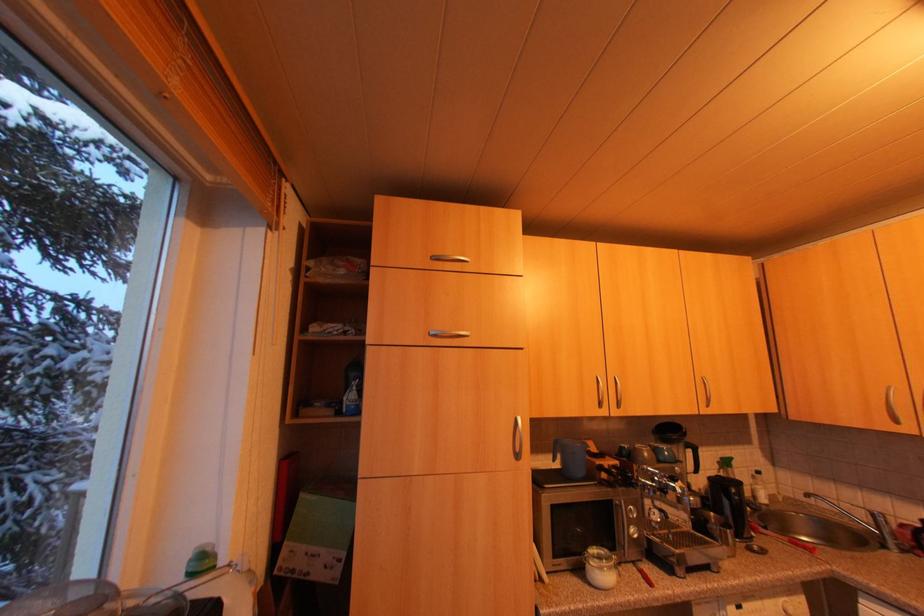
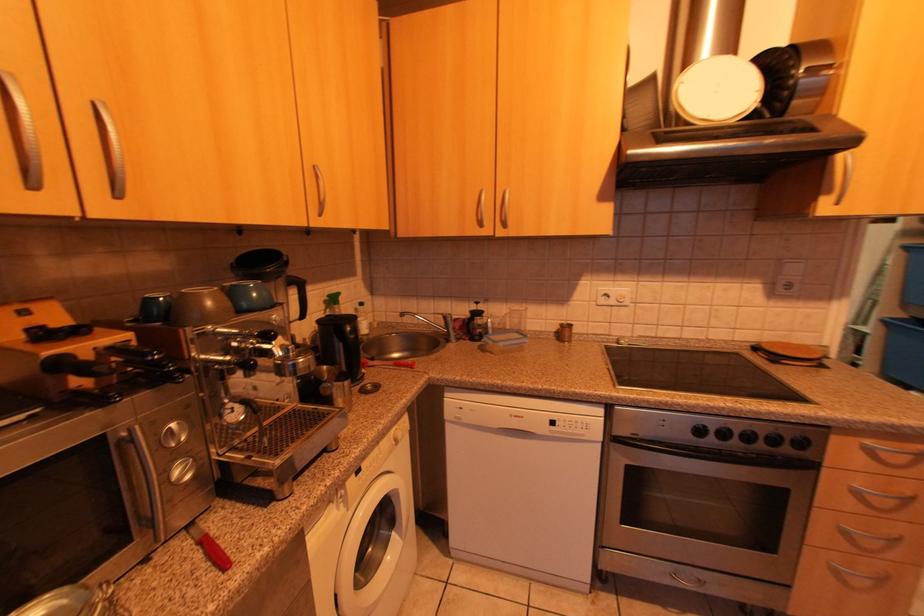
First-person continuous shooting, in which direction is the camera rotating?

The camera rotated toward right-down.